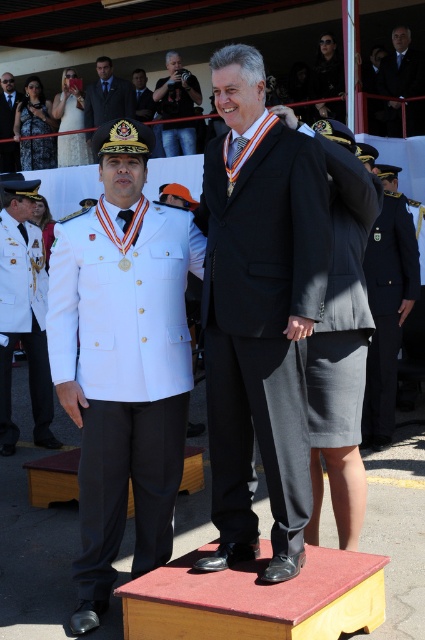
Question: Does black satin suit at center have a greater width compared to wooden podium at center?

Choices:
 (A) no
 (B) yes

Answer: (A)

Question: Which point is farther to the camera?

Choices:
 (A) black satin suit at center
 (B) denim jeans at upper center
 (C) white matte uniform at left

Answer: (B)

Question: Which point is closer to the camera taking this photo?

Choices:
 (A) (113, 115)
 (B) (99, 541)
 (C) (384, 385)
 (D) (2, 84)

Answer: (B)

Question: Which object appears closest to the camera in this image?

Choices:
 (A) navy blue fabric uniform at right
 (B) white matte uniform at left
 (C) denim jeans at upper center
 (D) black satin suit at center

Answer: (D)

Question: Does matte black suit at center have a larger size compared to denim jeans at upper center?

Choices:
 (A) no
 (B) yes

Answer: (B)

Question: Is dark blue uniform at center bigger than white uniform at left?

Choices:
 (A) yes
 (B) no

Answer: (A)